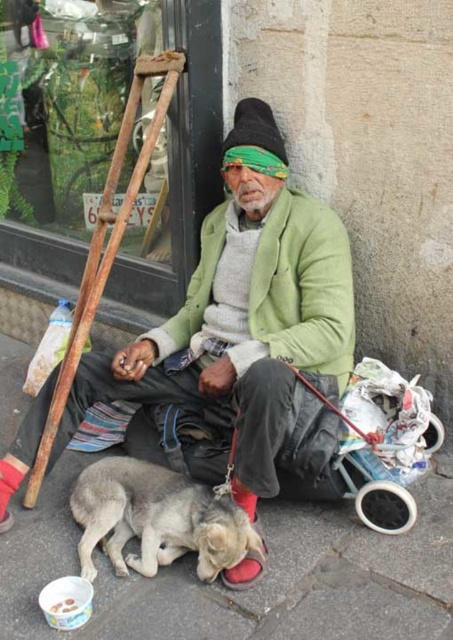
Question: Is green matte jacket at center to the left of fuzzy gray dog at lower left from the viewer's perspective?

Choices:
 (A) yes
 (B) no

Answer: (B)

Question: Can you confirm if gray concrete pavement at lower center is thinner than fuzzy gray dog at lower left?

Choices:
 (A) yes
 (B) no

Answer: (B)

Question: Can you confirm if gray concrete pavement at lower center is positioned above green matte jacket at center?

Choices:
 (A) no
 (B) yes

Answer: (A)

Question: Which object appears closest to the camera in this image?

Choices:
 (A) green knitted jacket at center
 (B) green matte jacket at center
 (C) gray concrete pavement at lower center
 (D) fuzzy gray dog at lower left

Answer: (C)

Question: Among these objects, which one is farthest from the camera?

Choices:
 (A) green knitted jacket at center
 (B) green matte jacket at center
 (C) fuzzy gray dog at lower left
 (D) gray concrete pavement at lower center

Answer: (B)

Question: Which point is farther from the camera taking this photo?

Choices:
 (A) (242, 113)
 (B) (337, 250)
 (C) (134, 502)
 (D) (1, 410)

Answer: (D)